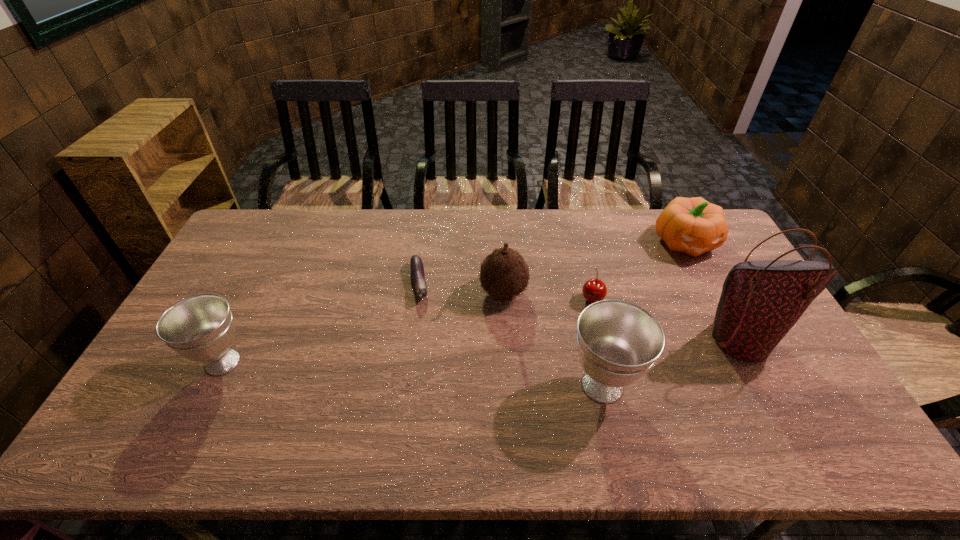
Locate an element on the screen. This screenshot has width=960, height=540. pumpkin present at the right edge is located at coordinates (694, 226).

Identify the location of handbag at the right edge. 761,301.

You are a GUI agent. You are given a task and a screenshot of the screen. Output one action in this format:
    pyautogui.click(x=<x>, y=<y>)
    Task: Click on the object present at the near left corner
    
    Given the screenshot: What is the action you would take?
    pyautogui.click(x=200, y=328)

Where is `object located at the far right corner`? object located at the far right corner is located at coordinates (694, 226).

The height and width of the screenshot is (540, 960). What are the coordinates of `vacant region at the far edge of the desktop` in the screenshot? It's located at (386, 239).

In the image, there is a desktop. Where is `vacant space at the near edge`? The height and width of the screenshot is (540, 960). vacant space at the near edge is located at coordinates (287, 392).

What are the coordinates of `free space at the right edge of the desktop` in the screenshot? It's located at (791, 382).

The height and width of the screenshot is (540, 960). In order to click on vacant region at the near left corner of the desktop in this screenshot , I will do `click(127, 413)`.

You are a GUI agent. You are given a task and a screenshot of the screen. Output one action in this format:
    pyautogui.click(x=<x>, y=<y>)
    Task: Click on the free spot between the cherry and the tallest object
    
    Given the screenshot: What is the action you would take?
    pyautogui.click(x=666, y=319)

In order to click on free space between the handbag and the second object from left to right in this screenshot , I will do `click(580, 311)`.